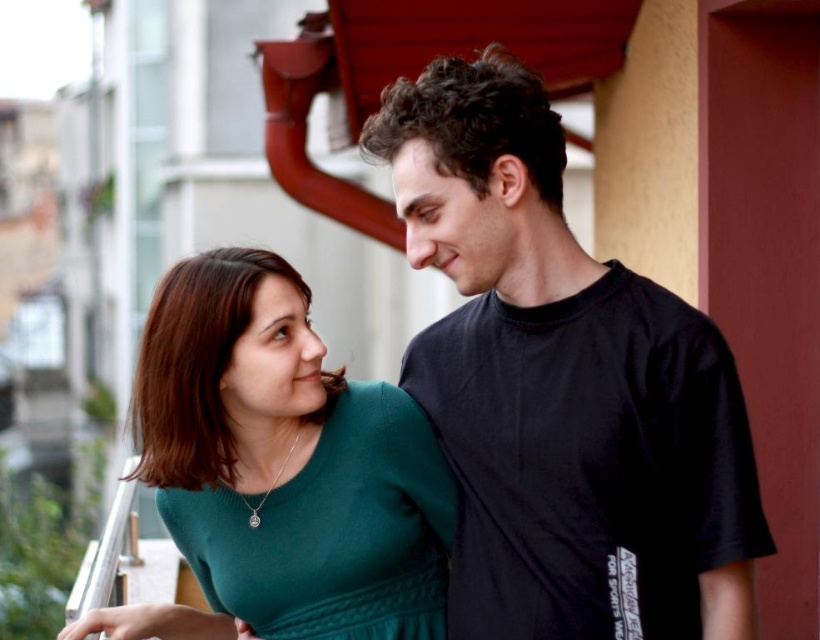
Question: Which of the following is the farthest from the observer?

Choices:
 (A) (636, 563)
 (B) (167, 618)

Answer: (B)

Question: Which object is farther from the camera taking this photo?

Choices:
 (A) green matte sweater at center
 (B) black cotton t-shirt at center

Answer: (A)

Question: From the image, what is the correct spatial relationship of black cotton t-shirt at center in relation to green matte sweater at center?

Choices:
 (A) right
 (B) left

Answer: (A)

Question: Does black cotton t-shirt at center appear on the left side of green matte sweater at center?

Choices:
 (A) no
 (B) yes

Answer: (A)

Question: Can you confirm if black cotton t-shirt at center is positioned to the right of green matte sweater at center?

Choices:
 (A) no
 (B) yes

Answer: (B)